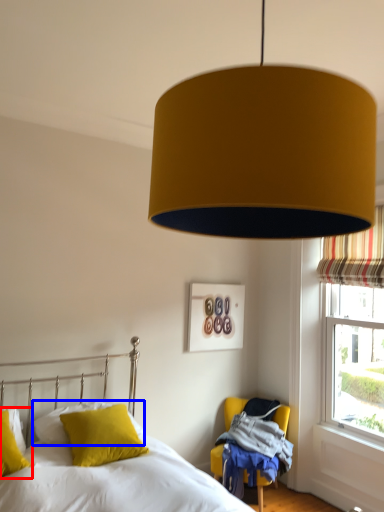
Question: Which of the following is the closest to the observer, pillow (highlighted by a red box) or pillow (highlighted by a blue box)?

Choices:
 (A) pillow
 (B) pillow

Answer: (A)